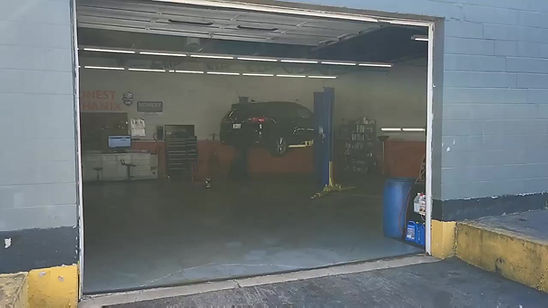
This screenshot has height=308, width=548. What are the coordinates of `storage` in the screenshot? It's located at (172, 150), (105, 163).